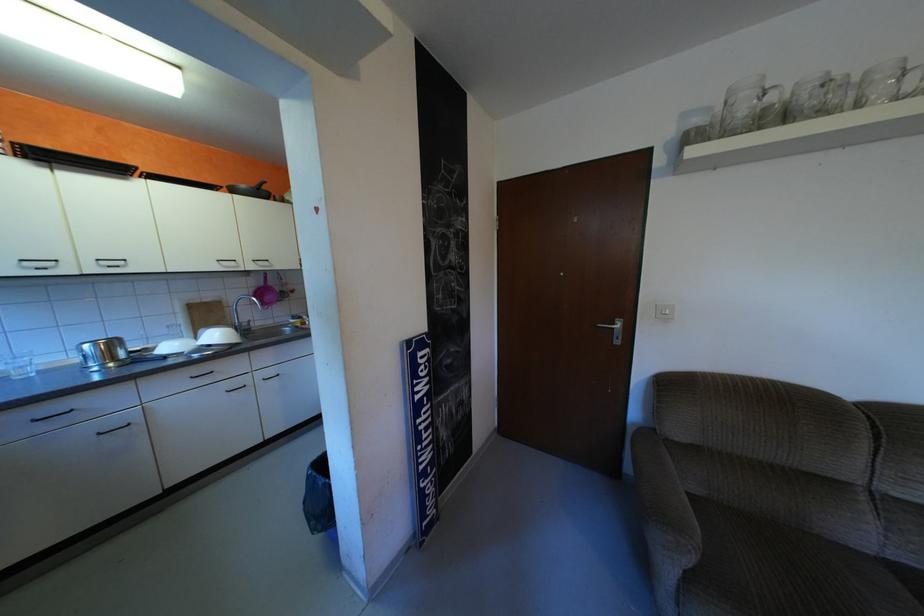
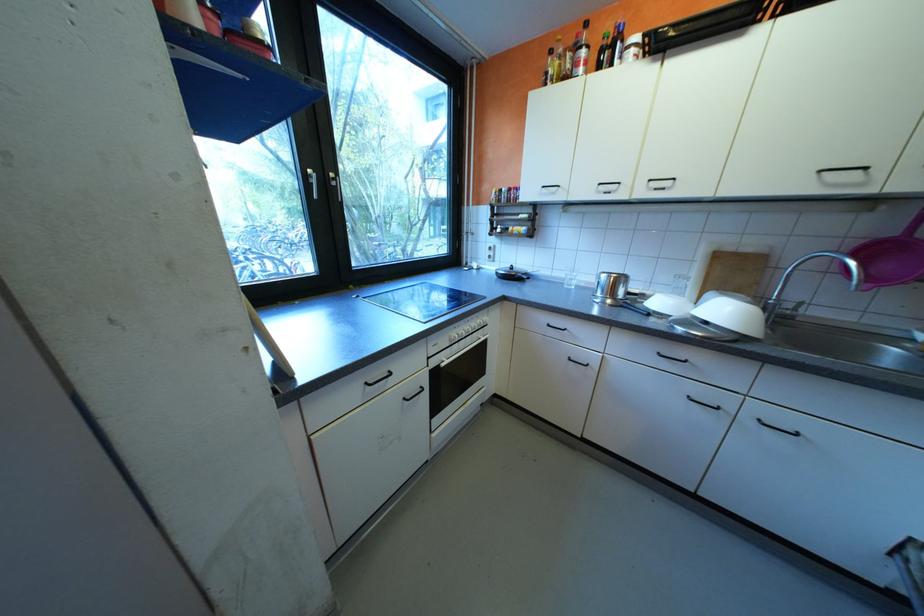
The point at (256, 330) is marked in the first image. Where is the corresponding point in the second image?

(791, 317)